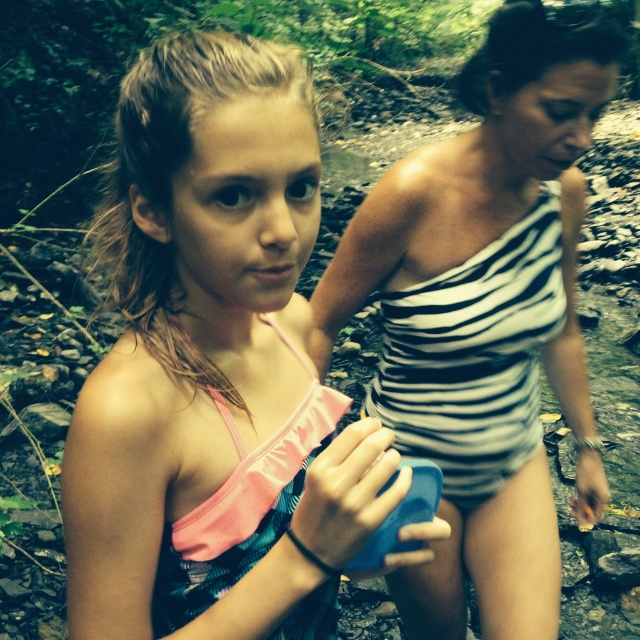
Question: Is pink fabric swimsuit at center further to camera compared to striped fabric swimsuit at center?

Choices:
 (A) no
 (B) yes

Answer: (A)

Question: Which point is closer to the camera taking this photo?

Choices:
 (A) (496, 259)
 (B) (99, 561)

Answer: (B)

Question: Is pink fabric swimsuit at center below striped fabric swimsuit at center?

Choices:
 (A) no
 (B) yes

Answer: (A)

Question: Which of the following is the farthest from the observer?

Choices:
 (A) striped fabric swimsuit at center
 (B) pink fabric swimsuit at center

Answer: (A)

Question: Is pink fabric swimsuit at center smaller than striped fabric swimsuit at center?

Choices:
 (A) yes
 (B) no

Answer: (A)